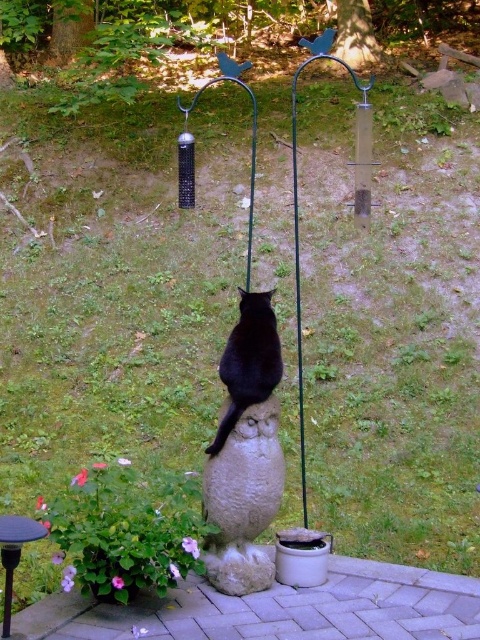
You are standing in the outdoor scene and want to place a small flag at each of the two points labeled point (189, 164) and point (240, 400). Which point is closer to you so that the flag will be more visible?

Point (189, 164) is further to the viewer than point (240, 400), so the flag placed at point (189, 164) will be more visible as it is closer to you.

What is located at the coordinates point (249, 360) in the image?

The black matte cat at center is located at point (249, 360).

You are a photographer trying to capture a closeup of the black matte cat at center and the metallic black stool at lower left in the scene. Since the cat is larger, will you need to adjust your camera position to focus on both objects equally?

The black matte cat at center is larger than the metallic black stool at lower left. To focus on both equally, you should position the camera closer to the smaller metallic black stool at lower left to balance their sizes in the frame.